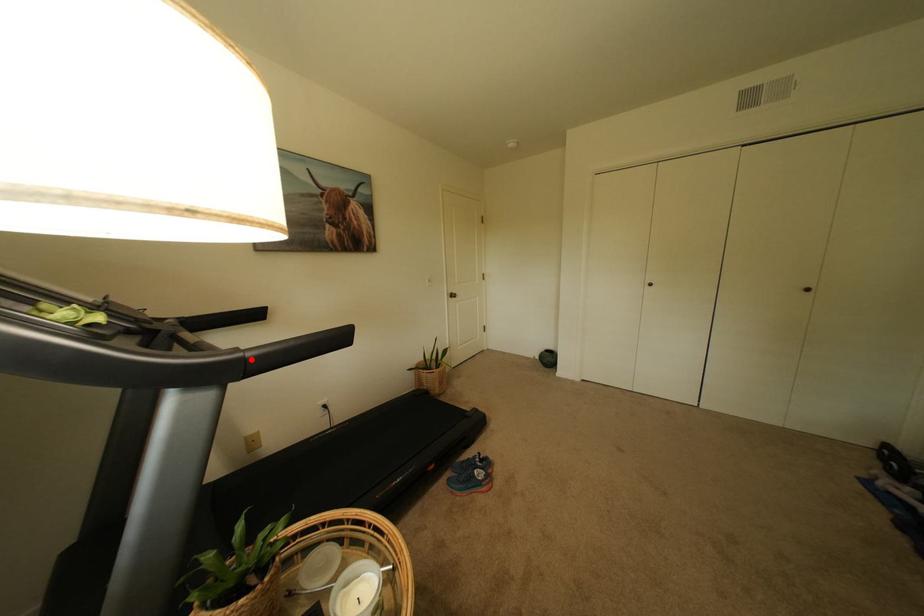
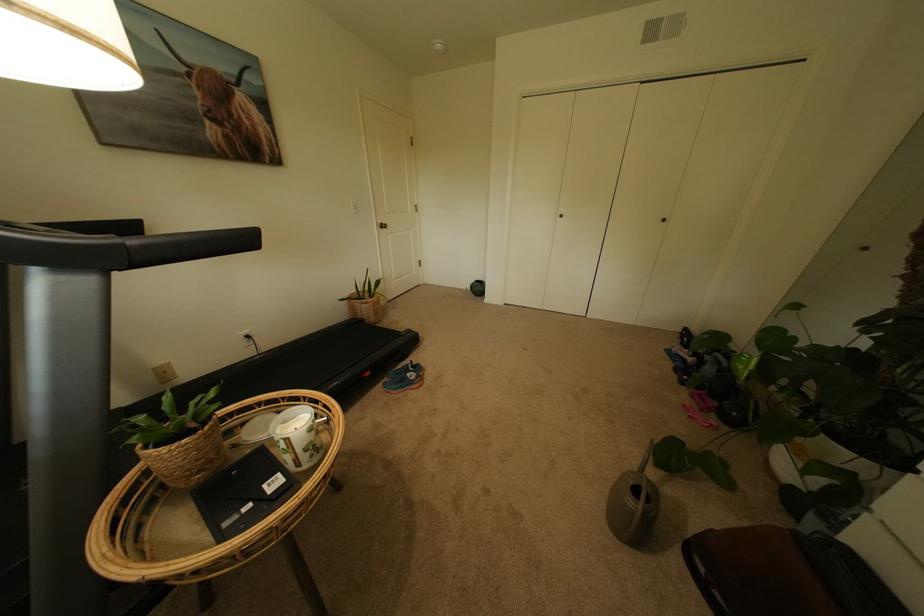
Where in the second image is the point corresponding to the highlighted location from the first image?

(131, 246)